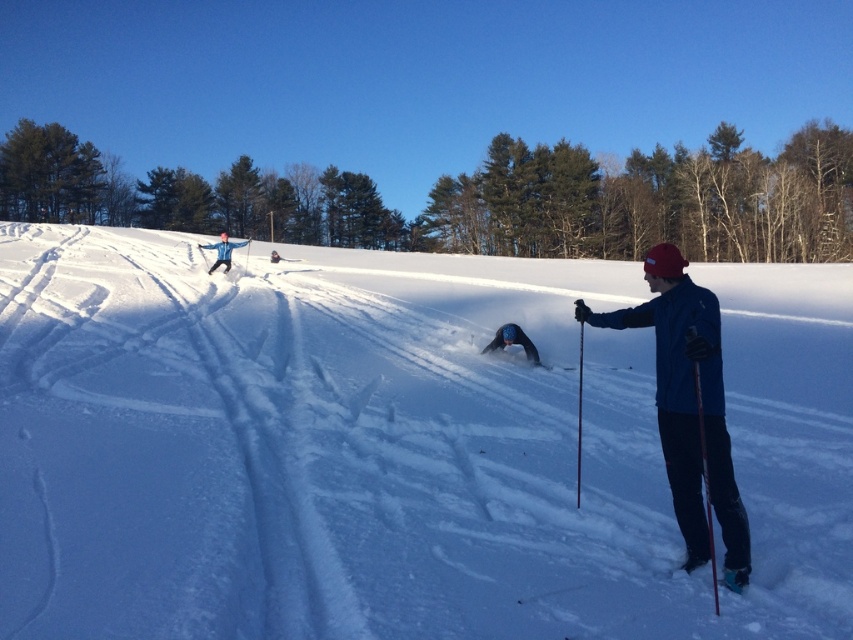
Question: Which of these objects is positioned closest to the dark blue jacket at upper left?

Choices:
 (A) white fluffy snow at center
 (B) red plastic ski pole at right
 (C) blue matte jacket at center

Answer: (A)

Question: Is black matte snowsuit at center below dark blue jacket at upper left?

Choices:
 (A) yes
 (B) no

Answer: (A)

Question: Is white fluffy snow at center smaller than black matte snowsuit at center?

Choices:
 (A) yes
 (B) no

Answer: (B)

Question: Which point is farther to the camera?

Choices:
 (A) (270, 257)
 (B) (676, 442)
 (C) (698, 364)
 (D) (218, 262)

Answer: (A)

Question: Which of the following is the closest to the observer?

Choices:
 (A) (230, 244)
 (B) (517, 324)

Answer: (B)

Question: Can you confirm if blue matte jacket at center is positioned to the left of black matte snowsuit at center?

Choices:
 (A) no
 (B) yes

Answer: (A)